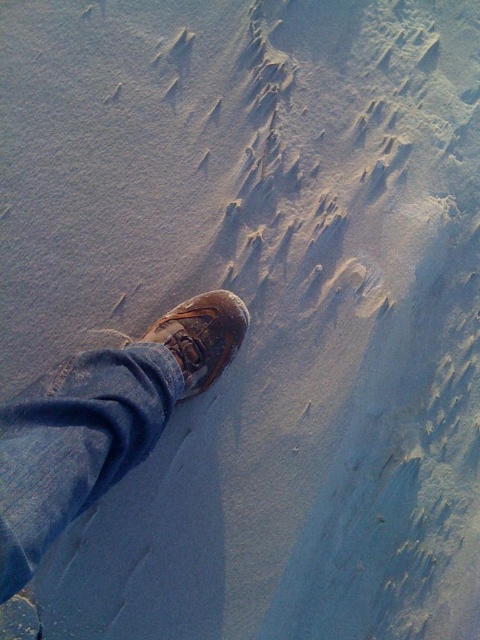
Is brown leather shoe at center positioned behind brown leather shoe at lower left?

That is False.

Locate an element on the screen. This screenshot has height=640, width=480. brown leather shoe at center is located at coordinates (100, 422).